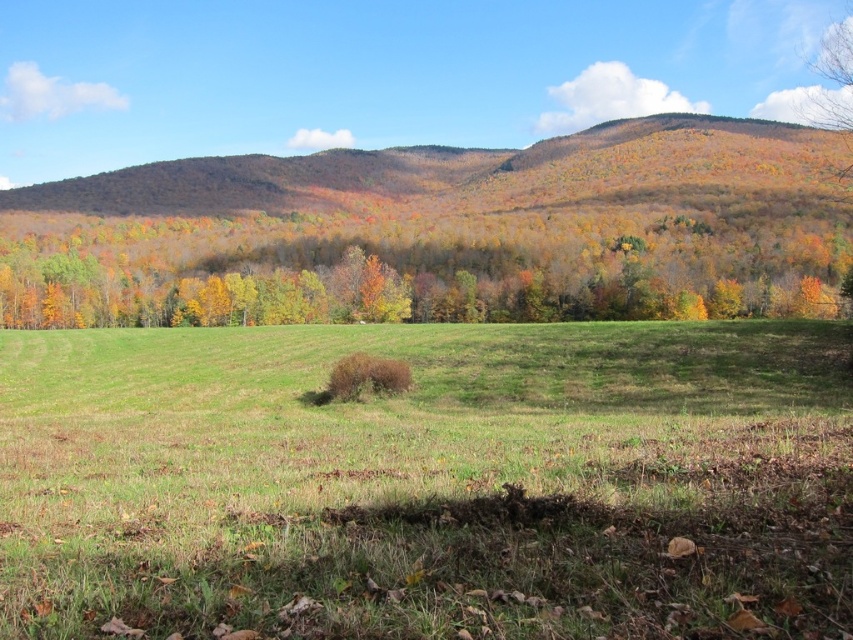
Question: From the image, what is the correct spatial relationship of green grassy field at center in relation to multicolored foliage at center?

Choices:
 (A) below
 (B) above

Answer: (A)

Question: Based on their relative distances, which object is nearer to the autumn foliage hill at center?

Choices:
 (A) green grassy field at center
 (B) smooth bark tree at upper right

Answer: (B)

Question: Does autumn foliage hill at center lie behind smooth bark tree at upper right?

Choices:
 (A) yes
 (B) no

Answer: (A)

Question: Which of the following is the farthest from the observer?

Choices:
 (A) autumn foliage hill at center
 (B) green grassy field at center

Answer: (A)

Question: Estimate the real-world distances between objects in this image. Which object is farther from the autumn foliage hill at center?

Choices:
 (A) smooth bark tree at upper right
 (B) multicolored foliage at center
 (C) green grassy field at center

Answer: (C)

Question: Is green grassy field at center thinner than smooth bark tree at upper right?

Choices:
 (A) no
 (B) yes

Answer: (B)